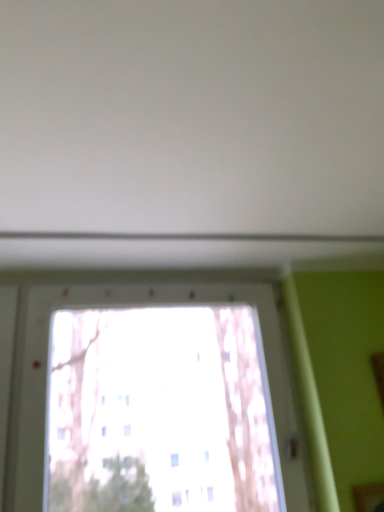
Find the location of a particular element. transparent glass window at center is located at coordinates (159, 412).

In order to face transparent glass window at center, should I rotate leftwards or rightwards?

A 5.459 degree turn to the left will do.

This screenshot has width=384, height=512. Describe the element at coordinates (159, 412) in the screenshot. I see `transparent glass window at center` at that location.

You are a GUI agent. You are given a task and a screenshot of the screen. Output one action in this format:
    pyautogui.click(x=<x>, y=<y>)
    Task: Click on the transparent glass window at center
    The width and height of the screenshot is (384, 512).
    Given the screenshot: What is the action you would take?
    pyautogui.click(x=159, y=412)